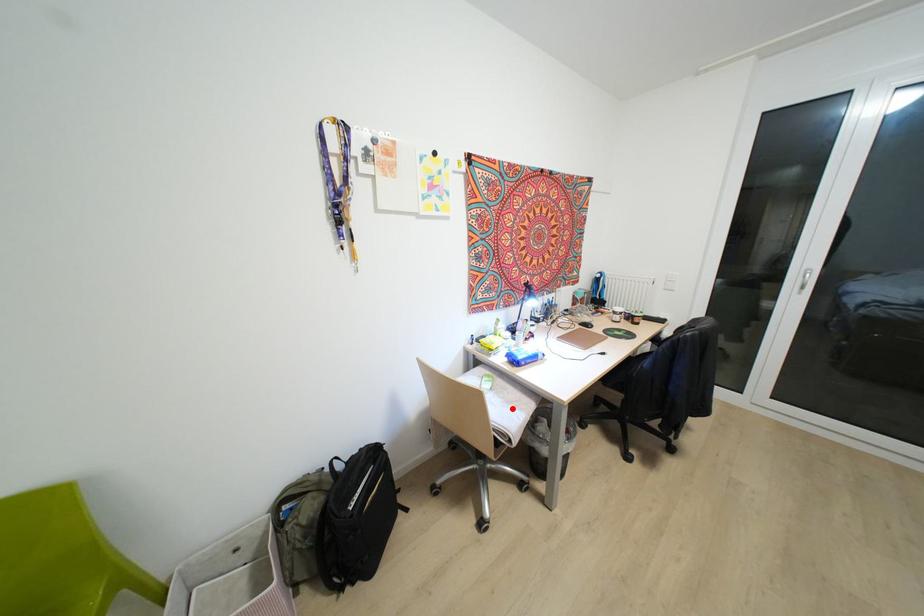
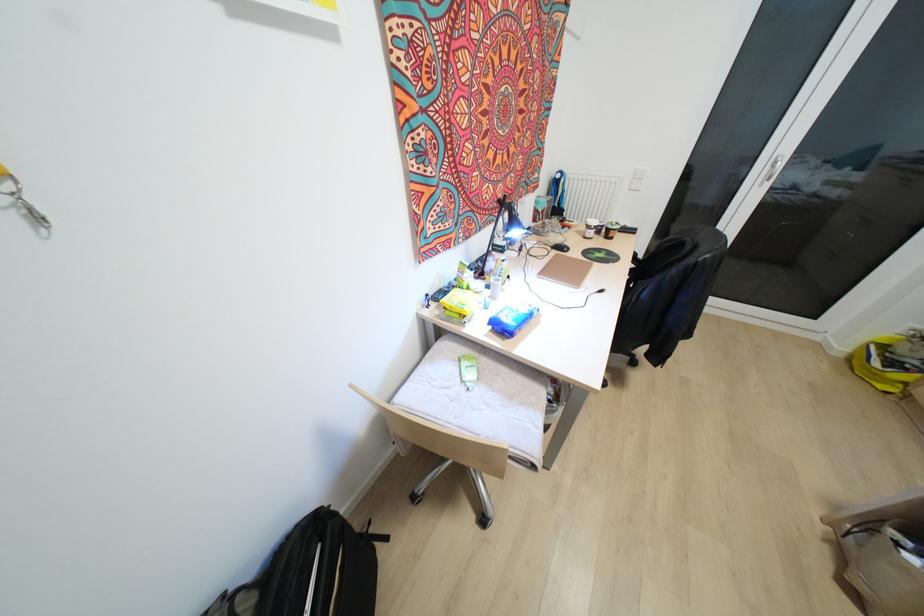
In the second image, find the point that corresponds to the highlighted location in the first image.

(519, 408)